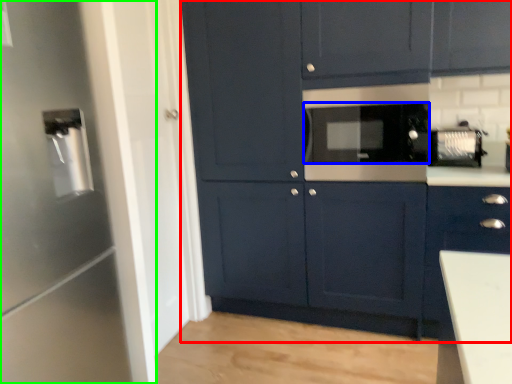
Question: Which is farther away from cabinetry (highlighted by a red box)? appliance (highlighted by a blue box) or appliance (highlighted by a green box)?

Choices:
 (A) appliance
 (B) appliance

Answer: (B)